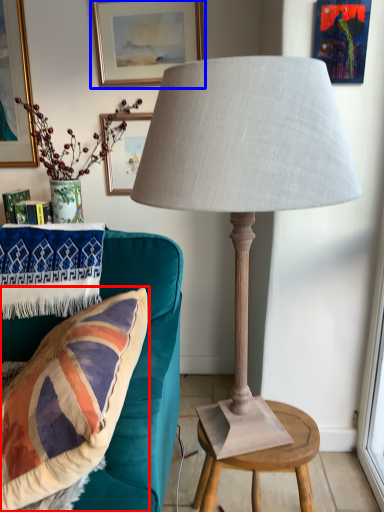
Question: Among these objects, which one is nearest to the camera, pillow (highlighted by a red box) or picture frame (highlighted by a blue box)?

Choices:
 (A) pillow
 (B) picture frame

Answer: (A)